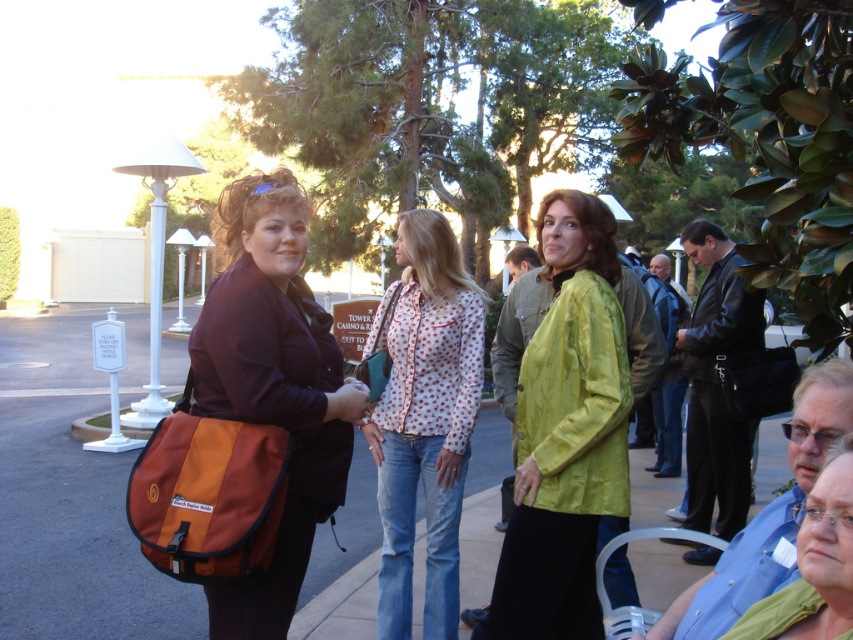
Is shiny green jacket at center below printed cotton blouse at center?

Correct, shiny green jacket at center is located below printed cotton blouse at center.

Who is more forward, (520, 531) or (381, 584)?

Point (520, 531)

Where is `shiny green jacket at center`? Image resolution: width=853 pixels, height=640 pixels. shiny green jacket at center is located at coordinates (566, 433).

Which is more to the right, matte brown bag at center or green matte jacket at lower right?

From the viewer's perspective, green matte jacket at lower right appears more on the right side.

Based on the photo, does matte brown bag at center appear on the left side of green matte jacket at lower right?

Correct, you'll find matte brown bag at center to the left of green matte jacket at lower right.

Which is in front, point (305, 234) or point (828, 564)?

Positioned in front is point (828, 564).

The height and width of the screenshot is (640, 853). What are the coordinates of `matte brown bag at center` in the screenshot? It's located at (273, 385).

Who is positioned more to the left, shiny green jacket at center or matte brown bag at center?

From the viewer's perspective, matte brown bag at center appears more on the left side.

Is shiny green jacket at center behind matte brown bag at center?

Yes, shiny green jacket at center is behind matte brown bag at center.

This screenshot has width=853, height=640. What are the coordinates of `shiny green jacket at center` in the screenshot? It's located at (566, 433).

The width and height of the screenshot is (853, 640). I want to click on shiny green jacket at center, so click(x=566, y=433).